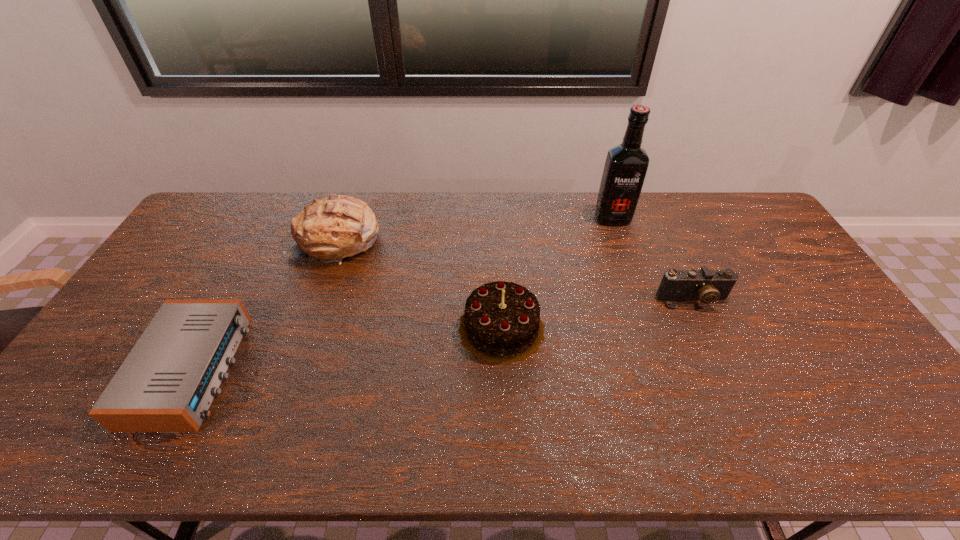
Find the location of `liquor positioned at the far edge`. liquor positioned at the far edge is located at coordinates (626, 165).

This screenshot has width=960, height=540. Identify the location of bread positioned at the far edge. (339, 226).

This screenshot has height=540, width=960. I want to click on object positioned at the near edge, so click(167, 383).

This screenshot has height=540, width=960. I want to click on object located in the left edge section of the desktop, so click(167, 383).

The image size is (960, 540). In order to click on object that is positioned at the near left corner in this screenshot , I will do [x=167, y=383].

Locate an element on the screen. blank area at the far edge is located at coordinates click(393, 195).

Where is `free space at the near edge`? The width and height of the screenshot is (960, 540). free space at the near edge is located at coordinates (374, 444).

In the image, there is a desktop. Where is `free space at the left edge`? This screenshot has height=540, width=960. free space at the left edge is located at coordinates (57, 411).

In the image, there is a desktop. Where is `free space at the right edge`? free space at the right edge is located at coordinates (802, 327).

You are a GUI agent. You are given a task and a screenshot of the screen. Output one action in this format:
    pyautogui.click(x=<x>, y=<y>)
    Task: Click on the unoccupied area between the radio receiver and the third object from right to left
    This screenshot has height=540, width=960.
    Given the screenshot: What is the action you would take?
    pyautogui.click(x=347, y=349)